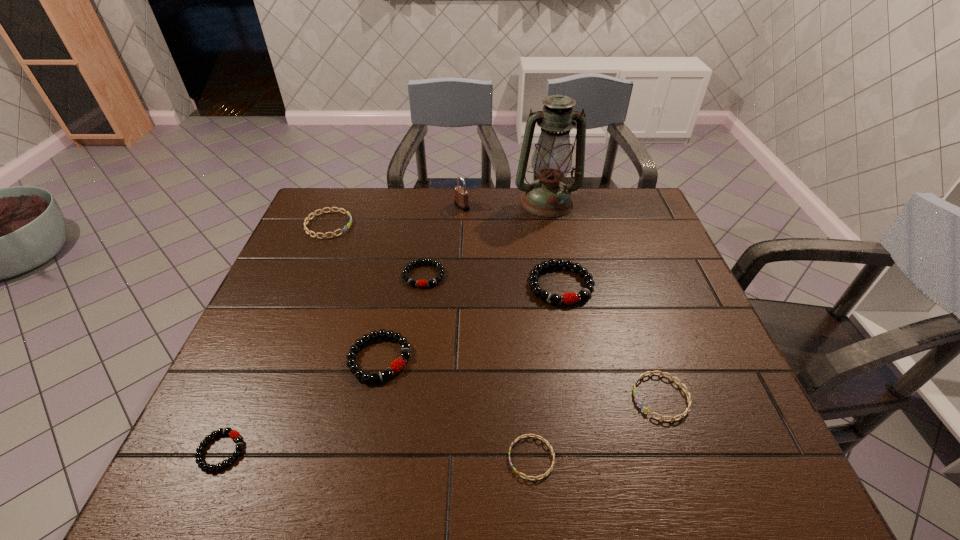
Find the location of `vacant area that lies between the second biggest blue bracelet and the biggest blue bracelet`. vacant area that lies between the second biggest blue bracelet and the biggest blue bracelet is located at coordinates coord(494,311).

Locate an element on the screen. This screenshot has width=960, height=540. object that is the fourth nearest to the smallest black bracelet is located at coordinates (345, 228).

Where is `object that ranks as the sixth closest to the biggest blue bracelet`? object that ranks as the sixth closest to the biggest blue bracelet is located at coordinates (233, 434).

You are a GUI agent. You are given a task and a screenshot of the screen. Output one action in this format:
    pyautogui.click(x=<x>, y=<y>)
    Task: Click on the bracelet that is the fourth closest one to the farthest blue bracelet
    Image resolution: width=960 pixels, height=540 pixels.
    Given the screenshot: What is the action you would take?
    pyautogui.click(x=233, y=434)

The image size is (960, 540). I want to click on the sixth closest bracelet to the third biggest black bracelet, so click(646, 410).

Point out which black bracelet is positioned as the third nearest to the second tallest object. Please provide its 2D coordinates. Your answer should be formatted as a tuple, i.e. [(x, y)], where the tuple contains the x and y coordinates of a point satisfying the conditions above.

[(397, 365)]

Select which black bracelet is the closest to the smallest black bracelet. Please provide its 2D coordinates. Your answer should be formatted as a tuple, i.e. [(x, y)], where the tuple contains the x and y coordinates of a point satisfying the conditions above.

[(397, 365)]

What are the coordinates of `blue bracelet identified as the second closest to the smallest blue bracelet` in the screenshot? It's located at (345, 228).

Find the location of a particular element. This screenshot has width=960, height=540. blue bracelet that is the second closest one to the leftmost black bracelet is located at coordinates (345, 228).

The image size is (960, 540). Find the location of `vacant space that satisfies the following two spatial constraints: 1. on the surface of the leftmost blue bracelet showing star-shaped elements; 2. on the left side of the second nearest black bracelet`. vacant space that satisfies the following two spatial constraints: 1. on the surface of the leftmost blue bracelet showing star-shaped elements; 2. on the left side of the second nearest black bracelet is located at coordinates (273, 358).